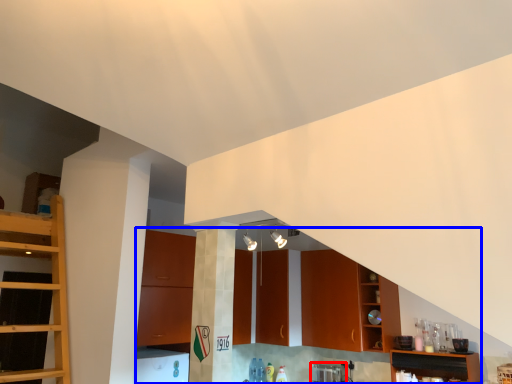
Question: Which point is further to the camera, appliance (highlighted by a red box) or cabinetry (highlighted by a blue box)?

Choices:
 (A) appliance
 (B) cabinetry

Answer: (A)